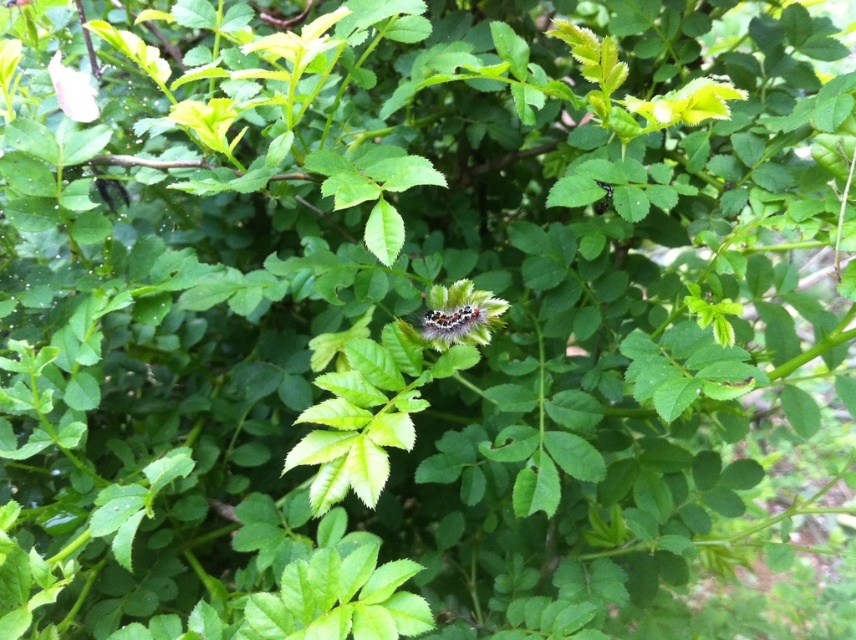
Can you confirm if fluffy multicolored caterpillar at center is bigger than smooth pink petal at upper left?

Actually, fluffy multicolored caterpillar at center might be smaller than smooth pink petal at upper left.

Between fluffy multicolored caterpillar at center and smooth pink petal at upper left, which one has less height?

With less height is fluffy multicolored caterpillar at center.

Is point (484, 312) closer to camera compared to point (62, 68)?

Yes, point (484, 312) is closer to viewer.

At what (x,y) coordinates should I click in order to perform the action: click on fluffy multicolored caterpillar at center. Please return your answer as a coordinate pair (x, y). This screenshot has width=856, height=640. Looking at the image, I should click on (456, 316).

Is fluffy multicolored caterpillar at center bigger than green fuzzy leaf at upper center?

No.

Does point (446, 337) lie in front of point (669, 102)?

No, (446, 337) is behind (669, 102).

The height and width of the screenshot is (640, 856). Find the location of `fluffy multicolored caterpillar at center`. fluffy multicolored caterpillar at center is located at coordinates (456, 316).

Is green fuzzy leaf at upper center shorter than smooth pink petal at upper left?

Indeed, green fuzzy leaf at upper center has a lesser height compared to smooth pink petal at upper left.

Does green fuzzy leaf at upper center appear on the left side of smooth pink petal at upper left?

No, green fuzzy leaf at upper center is not to the left of smooth pink petal at upper left.

Does point (681, 90) come in front of point (70, 88)?

Yes, it is in front of point (70, 88).

The width and height of the screenshot is (856, 640). In order to click on green fuzzy leaf at upper center in this screenshot , I will do pyautogui.click(x=687, y=104).